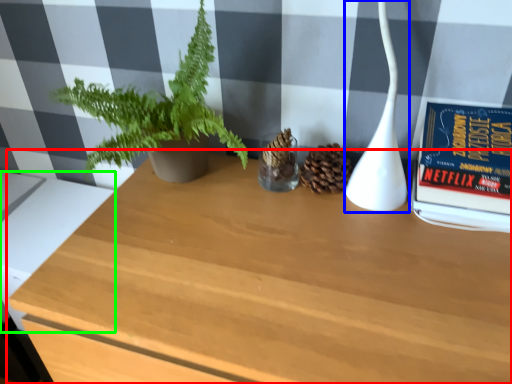
Question: Considering the real-world distances, which object is farthest from table (highlighted by a red box)? lamp (highlighted by a blue box) or table (highlighted by a green box)?

Choices:
 (A) lamp
 (B) table

Answer: (B)